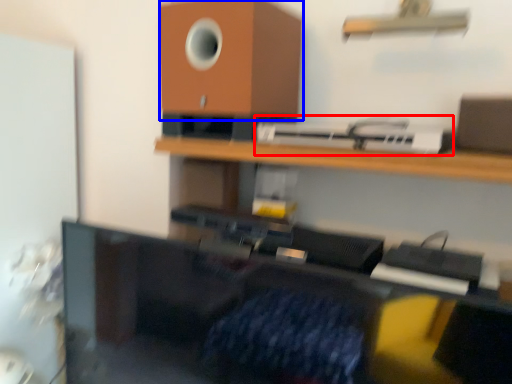
Question: Among these objects, which one is farthest to the camera, printer (highlighted by a red box) or speaker (highlighted by a blue box)?

Choices:
 (A) printer
 (B) speaker

Answer: (B)